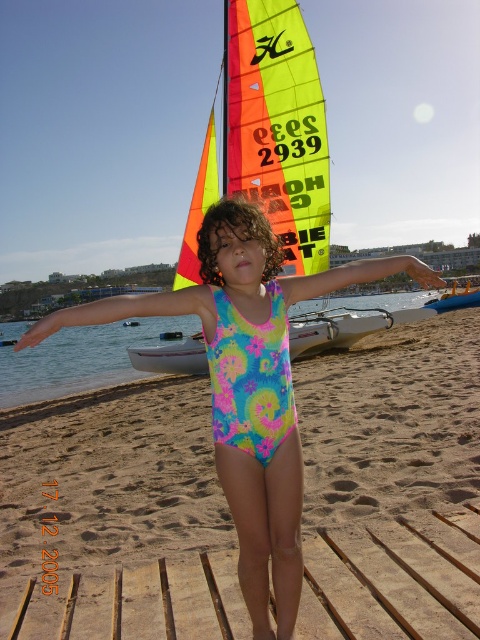
You are a photographer trying to capture the child in the image. The child has two fabric arms attached to their outfit. Which fabric arm, the multicolored fabric arm at center or the neon fabric arm at center, is closer to the camera?

The neon fabric arm at center is closer to the camera because the multicolored fabric arm at center is located below it, meaning the neon fabric arm is above and thus nearer to the viewer.